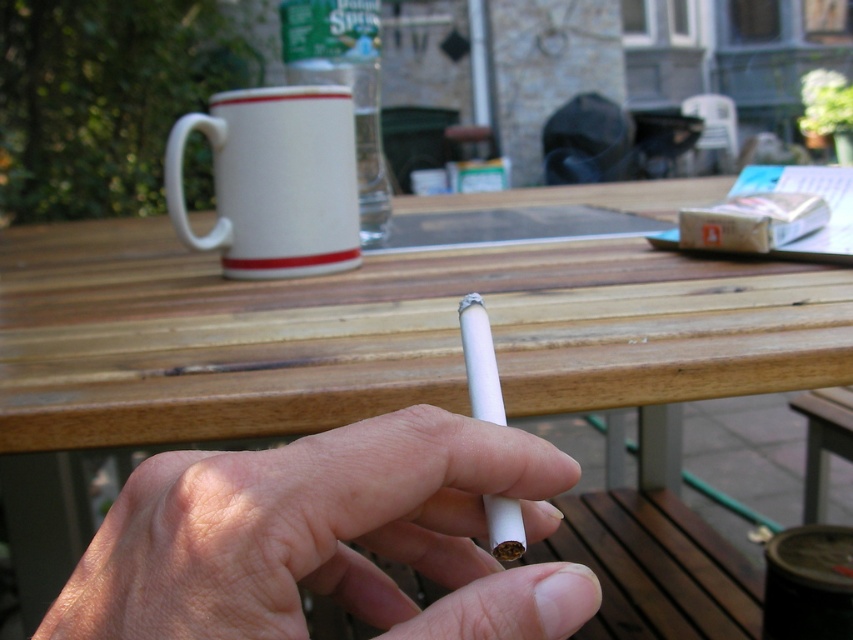
Can you confirm if wooden picnic table at center is positioned to the left of white ceramic mug at upper center?

No, wooden picnic table at center is not to the left of white ceramic mug at upper center.

Is wooden picnic table at center wider than white ceramic mug at upper center?

Indeed, wooden picnic table at center has a greater width compared to white ceramic mug at upper center.

Is point (44, 381) in front of point (186, 132)?

That is True.

The height and width of the screenshot is (640, 853). What are the coordinates of `wooden picnic table at center` in the screenshot? It's located at (389, 337).

Which is more to the right, white matte cigarette at center or white ceramic mug at upper center?

Positioned to the right is white matte cigarette at center.

Between point (503, 449) and point (273, 218), which one is positioned behind?

The point (273, 218) is behind.

Between point (399, 426) and point (248, 252), which one is positioned behind?

Positioned behind is point (248, 252).

At what (x,y) coordinates should I click in order to perform the action: click on white matte cigarette at center. Please return your answer as a coordinate pair (x, y). Looking at the image, I should click on (328, 538).

Which is behind, point (619, 248) or point (300, 563)?

Positioned behind is point (619, 248).

Which is in front, point (747, 348) or point (346, 468)?

Positioned in front is point (346, 468).

Image resolution: width=853 pixels, height=640 pixels. Identify the location of wooden picnic table at center. (389, 337).